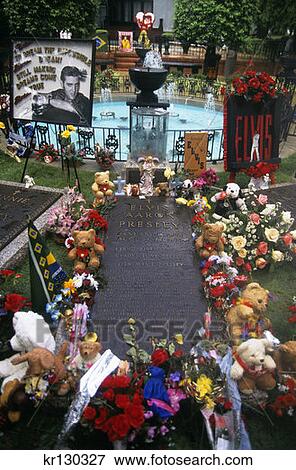
Identify the location of framed sign. Image resolution: width=296 pixels, height=470 pixels. (50, 64).